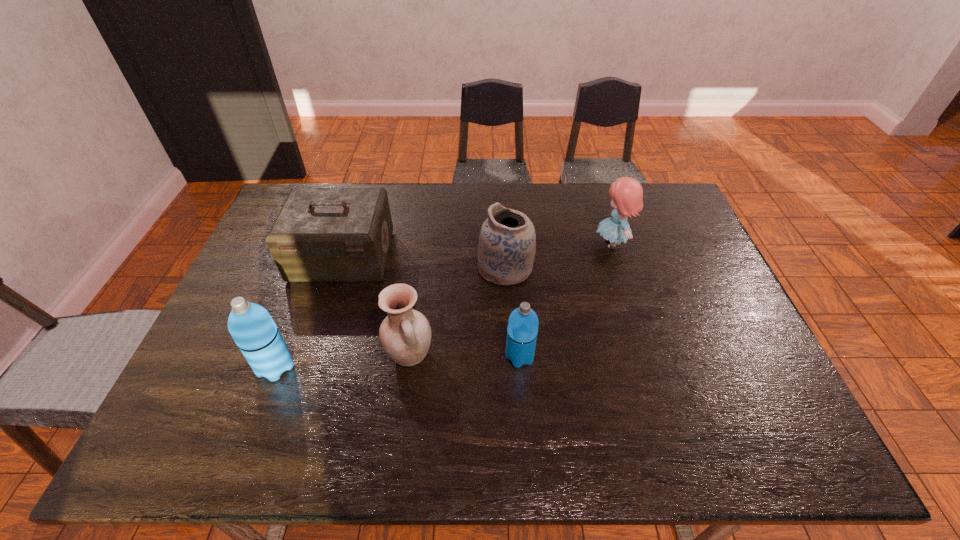
I want to click on free spot between the third object from left to right and the first-aid kit, so click(376, 306).

This screenshot has height=540, width=960. I want to click on vacant space that's between the first-aid kit and the right pottery, so click(423, 262).

Locate which object is the second closest to the farther pottery. Please provide its 2D coordinates. Your answer should be formatted as a tuple, i.e. [(x, y)], where the tuple contains the x and y coordinates of a point satisfying the conditions above.

[(405, 334)]

Identify the location of object that is the second closest to the left pottery. The width and height of the screenshot is (960, 540). (321, 234).